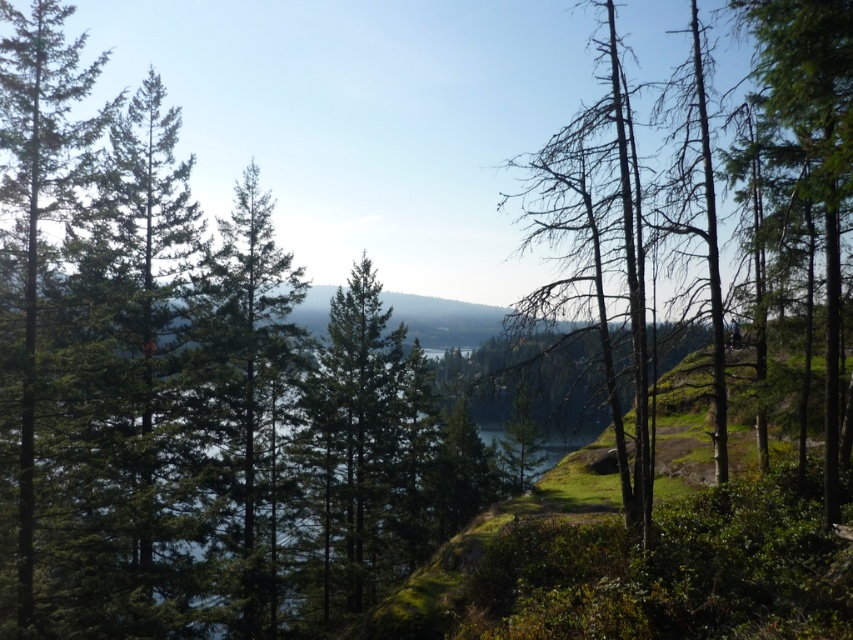
Question: Does green matte tree at left appear under green matte tree at right?

Choices:
 (A) no
 (B) yes

Answer: (A)

Question: Among these objects, which one is nearest to the camera?

Choices:
 (A) green matte tree at left
 (B) green matte tree at center

Answer: (A)

Question: Does green matte tree at left appear over green matte tree at right?

Choices:
 (A) yes
 (B) no

Answer: (A)

Question: Which of the following is the farthest from the observer?

Choices:
 (A) green matte tree at right
 (B) green matte tree at left

Answer: (B)

Question: Is green matte tree at center to the right of green matte tree at left from the viewer's perspective?

Choices:
 (A) yes
 (B) no

Answer: (A)

Question: Estimate the real-world distances between objects in this image. Which object is closer to the green matte tree at left?

Choices:
 (A) green matte tree at right
 (B) green matte tree at center

Answer: (B)